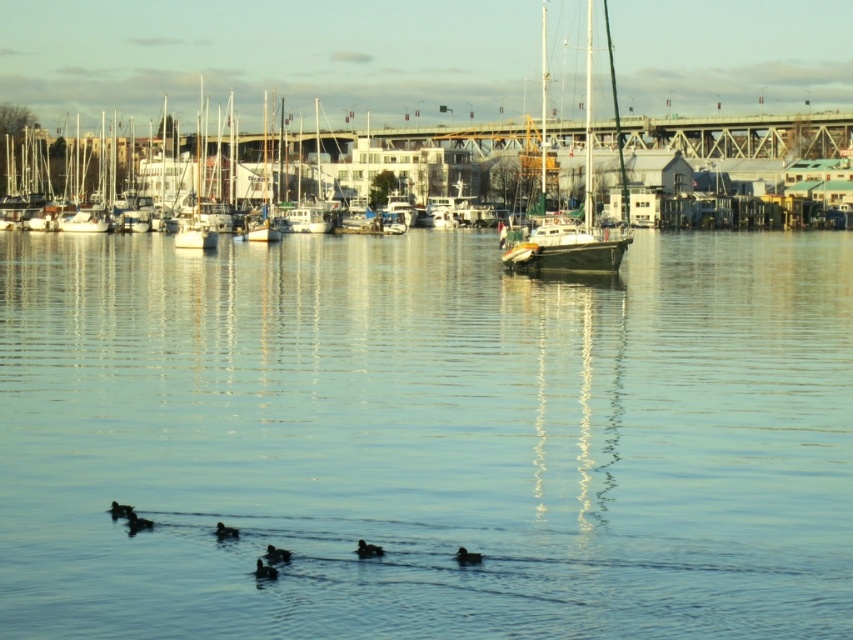
Question: Which object appears closest to the camera in this image?

Choices:
 (A) white matte sailboat at center
 (B) clear blue water at center
 (C) dark brown feathers at center

Answer: (B)

Question: Among these points, which one is nearest to the camera?

Choices:
 (A) (614, 257)
 (B) (265, 570)
 (C) (215, 532)
 (D) (364, 550)

Answer: (B)

Question: Can you confirm if clear blue water at center is positioned to the left of white wooden sailboat at center?

Choices:
 (A) no
 (B) yes

Answer: (B)

Question: Is brown fuzzy duck at lower center bigger than dark brown feathers at lower left?

Choices:
 (A) no
 (B) yes

Answer: (A)

Question: Can you confirm if brown fuzzy duck at lower center is wider than dark brown feathers at lower left?

Choices:
 (A) yes
 (B) no

Answer: (B)

Question: Which point is closer to the camera?

Choices:
 (A) dark brown feathers at lower center
 (B) clear blue water at center
 (C) black matte duck at lower left
 (D) dark brown duck at lower center

Answer: (B)